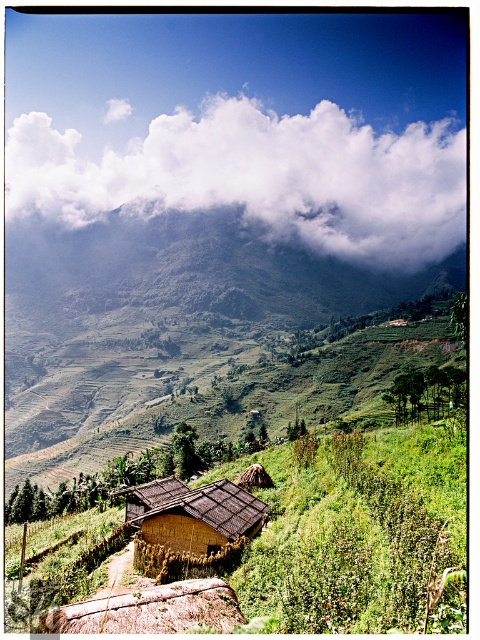
Which is more to the right, green grassy mountain at upper center or brown thatched hut at center?

Positioned to the right is brown thatched hut at center.

Is green grassy mountain at upper center bigger than brown thatched hut at center?

Yes.

Where is `green grassy mountain at upper center`? Image resolution: width=480 pixels, height=640 pixels. green grassy mountain at upper center is located at coordinates (193, 273).

Who is more distant from viewer, [122,184] or [217,560]?

The point [122,184] is behind.

Which is behind, point (264, 116) or point (170, 528)?

The point (264, 116) is behind.

This screenshot has width=480, height=640. Find the location of `white fluffy cloud at upper center`. white fluffy cloud at upper center is located at coordinates [260, 177].

Can you confirm if white fluffy cloud at upper center is bigger than green grassy mountain at upper center?

Yes, white fluffy cloud at upper center is bigger than green grassy mountain at upper center.

Who is shorter, white fluffy cloud at upper center or green grassy mountain at upper center?

With less height is green grassy mountain at upper center.

Is point (26, 202) more distant than point (238, 216)?

Yes, point (26, 202) is behind point (238, 216).

Identify the location of white fluffy cloud at upper center. This screenshot has width=480, height=640. pyautogui.click(x=260, y=177).